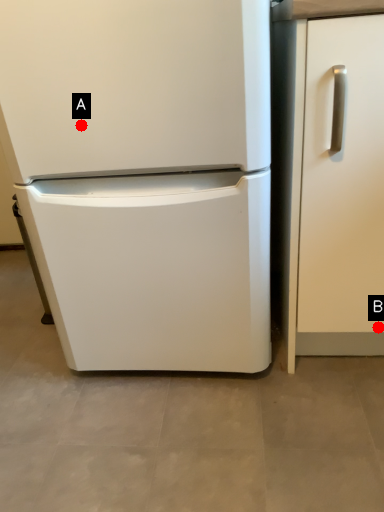
Question: Two points are circled on the image, labeled by A and B beside each circle. Which point is farther from the camera taking this photo?

Choices:
 (A) A is further
 (B) B is further

Answer: (B)